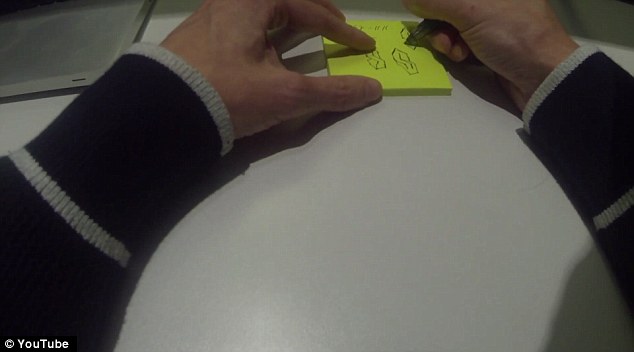
Locate the post it in the image. Your answer should be formatted as a list of tuples, i.e. [(x1, y1), (x2, y2), ...], where each tuple contains the x and y coordinates of a point satisfying the conditions above.

[(398, 39)]